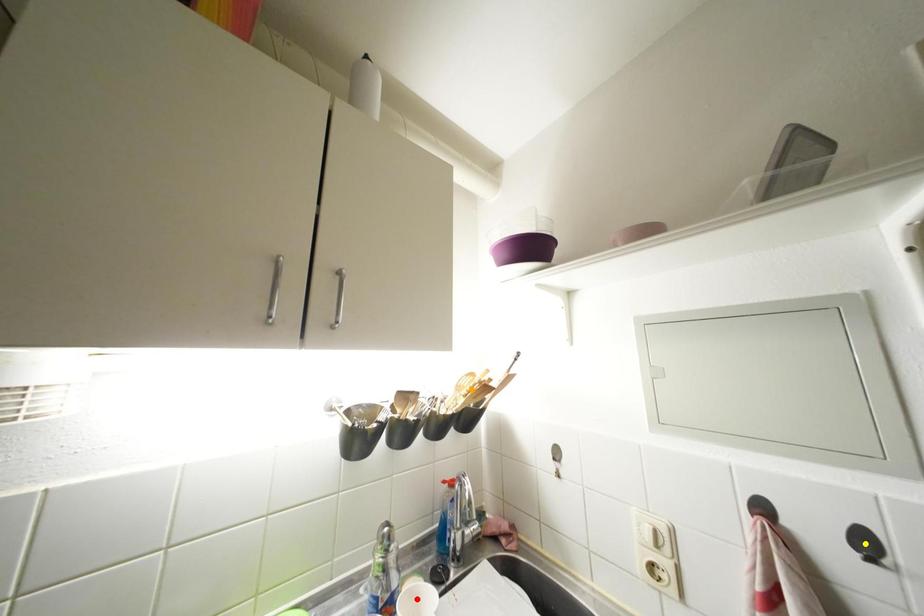
Order these from farthest to nearest:
- red point
- orange point
- yellow point

1. orange point
2. red point
3. yellow point